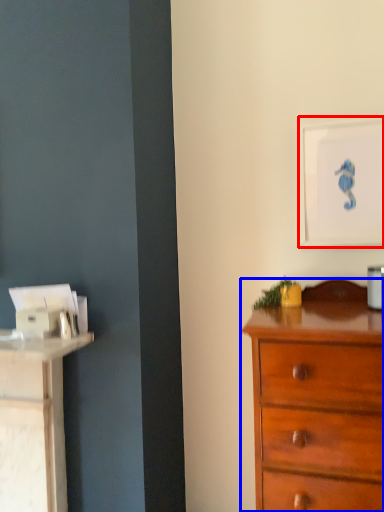
Question: Which of the following is the closest to the observer, picture frame (highlighted by a red box) or chest of drawers (highlighted by a blue box)?

Choices:
 (A) picture frame
 (B) chest of drawers

Answer: (B)